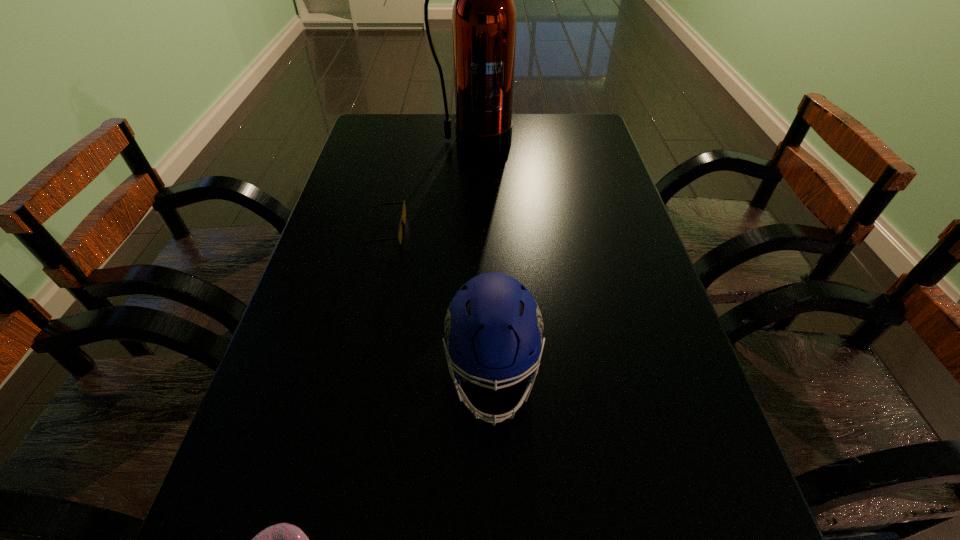
Where is `free point between the second farthest object and the farthest object`? free point between the second farthest object and the farthest object is located at coordinates (430, 187).

This screenshot has width=960, height=540. I want to click on object that ranks as the third closest to the shortest object, so click(x=484, y=19).

Identify the location of object that ranks as the second closest to the sunglasses. (484, 19).

The width and height of the screenshot is (960, 540). I want to click on free region that satisfies the following two spatial constraints: 1. on the front-facing side of the farthest object; 2. on the front-facing side of the third nearest object, so [x=470, y=232].

Locate an element on the screen. The width and height of the screenshot is (960, 540). blank space that satisfies the following two spatial constraints: 1. on the front-facing side of the farthest object; 2. on the front-facing side of the second shortest object is located at coordinates (470, 232).

Where is `vacant point that satisfies the following two spatial constraints: 1. on the front-facing side of the tallest object; 2. on the front-facing side of the second farthest object`? Image resolution: width=960 pixels, height=540 pixels. vacant point that satisfies the following two spatial constraints: 1. on the front-facing side of the tallest object; 2. on the front-facing side of the second farthest object is located at coordinates (470, 232).